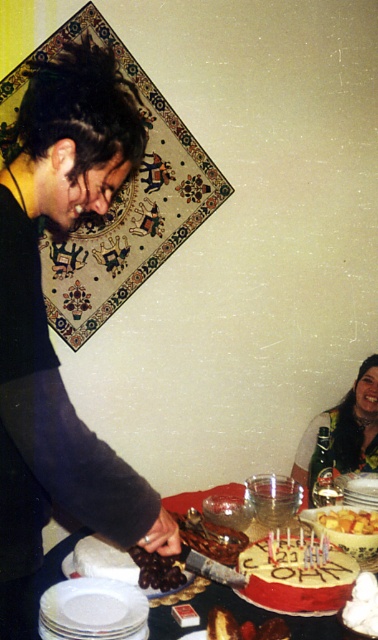
Is dark brown hair at upper left further to camera compared to chocolate-covered nuts at center?

No.

Does dark brown hair at upper left have a smaller size compared to chocolate-covered nuts at center?

Actually, dark brown hair at upper left might be larger than chocolate-covered nuts at center.

Where is `dark brown hair at upper left`? Image resolution: width=378 pixels, height=640 pixels. dark brown hair at upper left is located at coordinates (46, 324).

Does white ceramic plate at lower left have a lesser height compared to yellow cake at lower center?

Result: No.

Where is `white ceramic plate at lower left`? Image resolution: width=378 pixels, height=640 pixels. white ceramic plate at lower left is located at coordinates (92, 611).

Find the location of `white ceramic plate at lower left`. white ceramic plate at lower left is located at coordinates (92, 611).

Who is lower down, dark brown hair at upper left or white ceramic plate at lower left?

white ceramic plate at lower left is below.

Between point (12, 323) and point (116, 620), which one is positioned in front?

Positioned in front is point (12, 323).

I want to click on dark brown hair at upper left, so click(x=46, y=324).